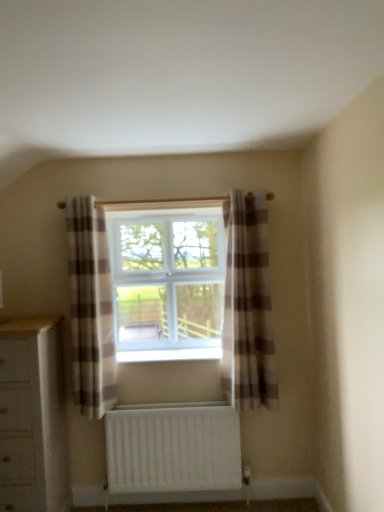
Question: From the image's perspective, is white plastic window at center located beneath plaid fabric curtain at center, placed as the 2th curtain when sorted from right to left?

Choices:
 (A) yes
 (B) no

Answer: (B)

Question: Considering the relative sizes of white plastic window at center and plaid fabric curtain at center, marked as the 1th curtain in a left-to-right arrangement, in the image provided, is white plastic window at center smaller than plaid fabric curtain at center, marked as the 1th curtain in a left-to-right arrangement,?

Choices:
 (A) yes
 (B) no

Answer: (B)

Question: Is white plastic window at center far away from plaid fabric curtain at center, marked as the 1th curtain in a left-to-right arrangement?

Choices:
 (A) yes
 (B) no

Answer: (B)

Question: Is plaid fabric curtain at center, marked as the 1th curtain in a left-to-right arrangement, at the back of white plastic window at center?

Choices:
 (A) no
 (B) yes

Answer: (A)

Question: Can you confirm if white plastic window at center is shorter than plaid fabric curtain at center, marked as the 1th curtain in a left-to-right arrangement?

Choices:
 (A) yes
 (B) no

Answer: (A)

Question: Considering the positions of white plastic window at center and white matte radiator at lower center in the image, is white plastic window at center taller or shorter than white matte radiator at lower center?

Choices:
 (A) short
 (B) tall

Answer: (B)

Question: Is white plastic window at center to the left or to the right of white matte radiator at lower center in the image?

Choices:
 (A) right
 (B) left

Answer: (B)

Question: From a real-world perspective, is white plastic window at center positioned above or below white matte radiator at lower center?

Choices:
 (A) above
 (B) below

Answer: (A)

Question: In terms of width, does white plastic window at center look wider or thinner when compared to white matte radiator at lower center?

Choices:
 (A) wide
 (B) thin

Answer: (A)

Question: Is point (26, 355) closer or farther from the camera than point (99, 391)?

Choices:
 (A) farther
 (B) closer

Answer: (B)

Question: From a real-world perspective, is white wood chest of drawers at lower left above or below plaid fabric curtain at center, placed as the 2th curtain when sorted from right to left?

Choices:
 (A) above
 (B) below

Answer: (B)

Question: Considering their positions, is white wood chest of drawers at lower left located in front of or behind plaid fabric curtain at center, marked as the 1th curtain in a left-to-right arrangement?

Choices:
 (A) behind
 (B) front

Answer: (B)

Question: Is white wood chest of drawers at lower left inside the boundaries of plaid fabric curtain at center, marked as the 1th curtain in a left-to-right arrangement, or outside?

Choices:
 (A) inside
 (B) outside

Answer: (B)

Question: From the image's perspective, relative to white plastic window at center, is plaid fabric curtain at center, arranged as the second curtain when viewed from the left, above or below?

Choices:
 (A) above
 (B) below

Answer: (B)

Question: From a real-world perspective, is plaid fabric curtain at center, which is the first curtain from right to left, positioned above or below white plastic window at center?

Choices:
 (A) above
 (B) below

Answer: (B)